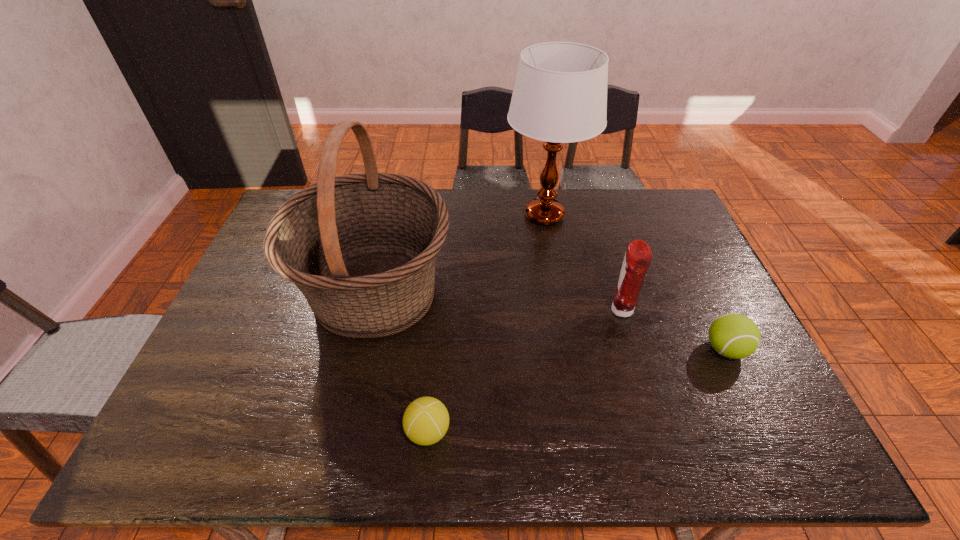
At what (x,y) coordinates should I click in order to perform the action: click on free space located 0.310m on the left of the rightmost object. Please return your answer as a coordinate pair (x, y). Looking at the image, I should click on (585, 349).

At what (x,y) coordinates should I click in order to perform the action: click on vacant region located on the left of the left tennis ball. Please return your answer as a coordinate pair (x, y). This screenshot has height=540, width=960. Looking at the image, I should click on (272, 431).

The image size is (960, 540). In order to click on object positioned at the far edge in this screenshot , I will do `click(560, 94)`.

Find the location of a particular element. This screenshot has width=960, height=540. object that is at the near edge is located at coordinates (426, 420).

The width and height of the screenshot is (960, 540). I want to click on object that is positioned at the right edge, so click(733, 335).

Find the location of a particular element. This screenshot has height=540, width=960. free space at the far edge of the desktop is located at coordinates (493, 192).

Image resolution: width=960 pixels, height=540 pixels. Identify the location of vacant region at the near edge of the desktop. (696, 457).

This screenshot has height=540, width=960. In the image, there is a desktop. What are the coordinates of `vacant space at the left edge` in the screenshot? It's located at (x=272, y=298).

The image size is (960, 540). In the image, there is a desktop. What are the coordinates of `vacant space at the right edge` in the screenshot? It's located at (660, 262).

In the image, there is a desktop. Where is `vacant space at the near left corner`? The image size is (960, 540). vacant space at the near left corner is located at coordinates (201, 456).